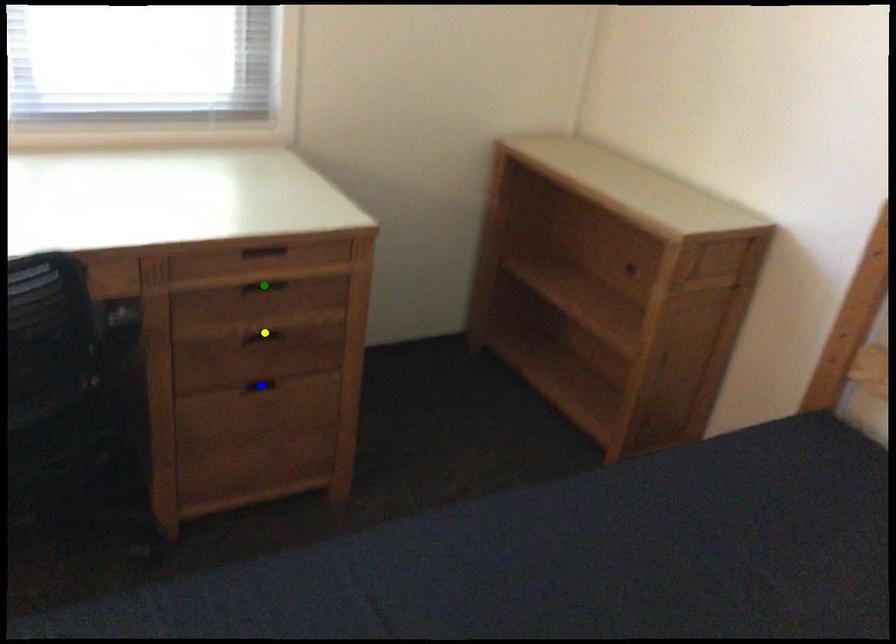
Order these from nearest to farthest:
A) yellow point
B) green point
C) blue point

green point
yellow point
blue point